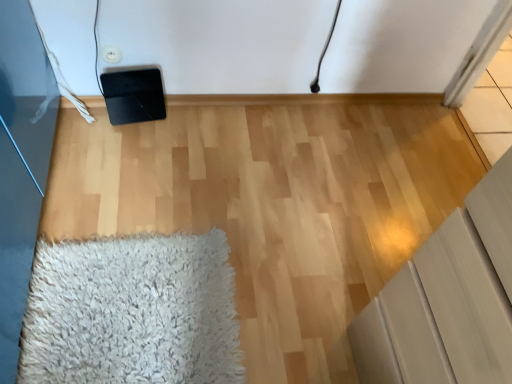
Where is `vacant space in white shaggy rug at lower left (from a real-world perspective)`? vacant space in white shaggy rug at lower left (from a real-world perspective) is located at coordinates (139, 317).